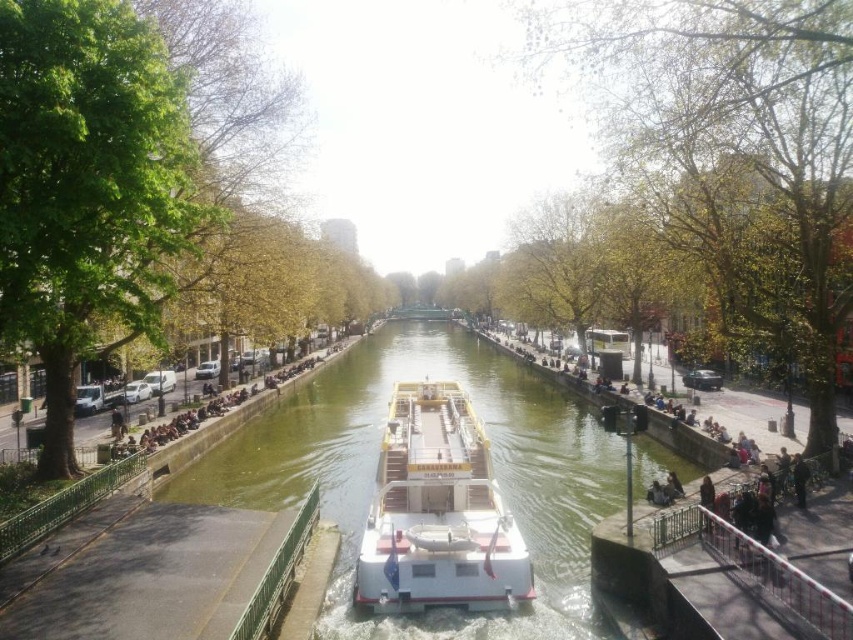
Looking at this image, you are a tour guide on a boat that is 25 feet long. You are currently navigating the canal and want to pass through a narrow section. The narrow section is as wide as the distance between the green smooth water at center and the white matte boat at center. Can your boat safely pass through the narrow section without touching the sides?

The distance between the green smooth water at center and the white matte boat at center is 34.39 feet. Since your boat is 25 feet long, it can safely pass through the narrow section as the width is sufficient to accommodate its length without touching the sides.

You are standing on the deck of the Canalrama tour boat and want to determine which of the two points, point (766, 61) or point (396, 344), is closer to you. Based on the scene description, can you identify which point is nearer?

Point (766, 61) is closer to the viewer than point (396, 344).